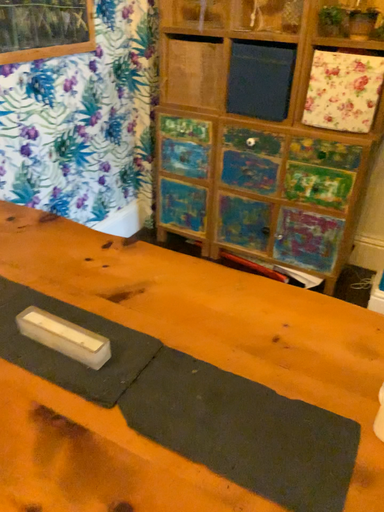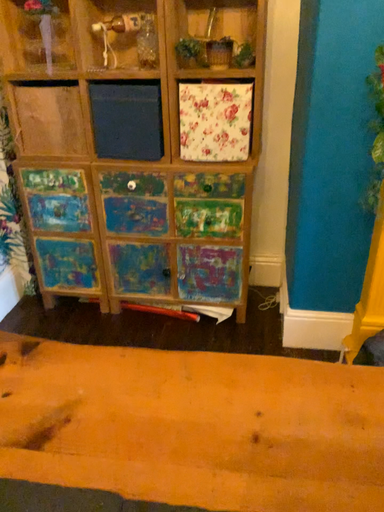
Question: How did the camera likely rotate when shooting the video?

Choices:
 (A) rotated left
 (B) rotated right

Answer: (B)